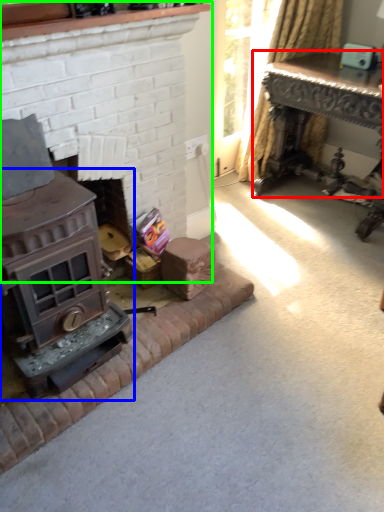
Question: Which is nearer to the table (highlighted by a red box)? wood burning stove (highlighted by a blue box) or fireplace (highlighted by a green box).

Choices:
 (A) wood burning stove
 (B) fireplace

Answer: (B)